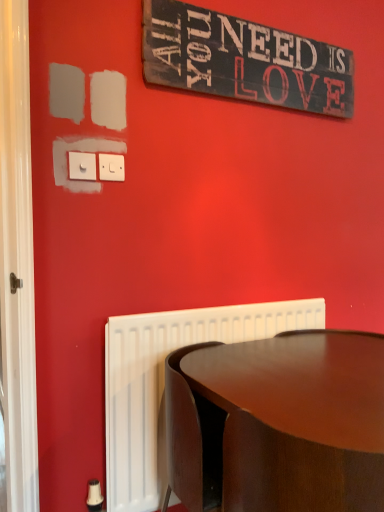
Question: From their relative heights in the image, would you say white glossy door at left is taller or shorter than white plastic switch at upper left, the first electric outlet when ordered from right to left?

Choices:
 (A) tall
 (B) short

Answer: (A)

Question: Considering the positions of white glossy door at left and white plastic switch at upper left, which is counted as the 1th electric outlet, starting from the back, in the image, is white glossy door at left wider or thinner than white plastic switch at upper left, which is counted as the 1th electric outlet, starting from the back,?

Choices:
 (A) thin
 (B) wide

Answer: (B)

Question: Estimate the real-world distances between objects in this image. Which object is farther from the glossy wood table at lower right?

Choices:
 (A) white plastic switch at upper left, which is counted as the 1th electric outlet, starting from the back
 (B) white glossy door at left
 (C) white plastic switch at upper left, acting as the 2th electric outlet starting from the back
 (D) rustic wood signboard at upper center

Answer: (D)

Question: Based on their relative distances, which object is farther from the white plastic switch at upper left, arranged as the first electric outlet when viewed from the front?

Choices:
 (A) white plastic switch at upper left, placed as the second electric outlet when sorted from left to right
 (B) glossy wood table at lower right
 (C) rustic wood signboard at upper center
 (D) white glossy door at left

Answer: (B)